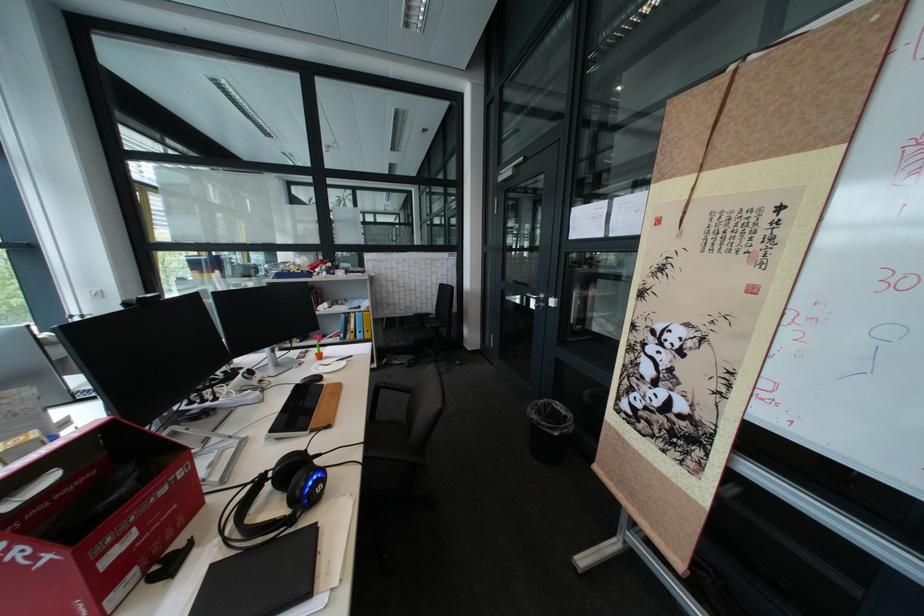
Where would you lift the black mesh trashcan? Please return your answer as a coordinate pair (x, y).

(548, 430)